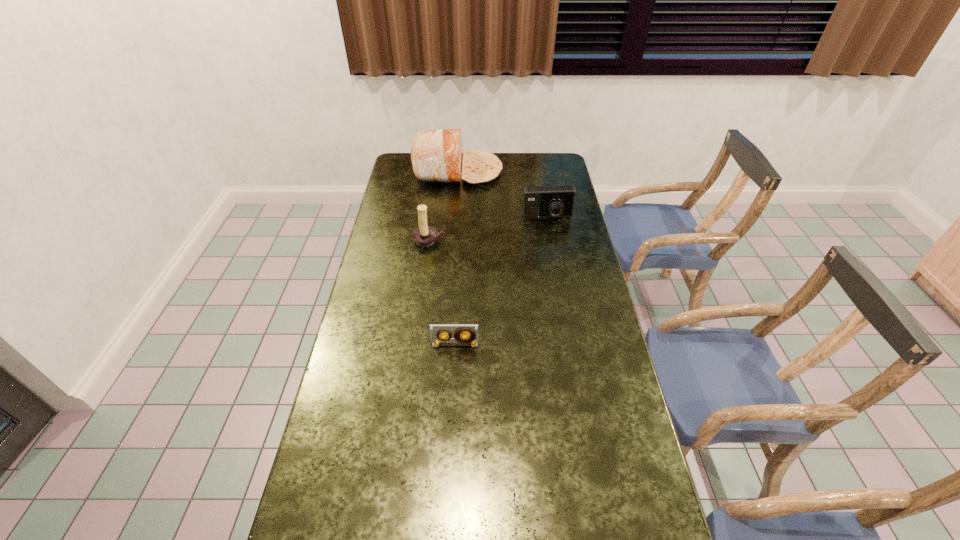
Where is `object that is at the far edge`? object that is at the far edge is located at coordinates (436, 155).

Where is `bread at the left edge`? The width and height of the screenshot is (960, 540). bread at the left edge is located at coordinates (436, 155).

Where is `candle holder at the left edge`? This screenshot has width=960, height=540. candle holder at the left edge is located at coordinates (424, 236).

The width and height of the screenshot is (960, 540). What are the coordinates of `object at the right edge` in the screenshot? It's located at (539, 202).

This screenshot has width=960, height=540. I want to click on object located in the far left corner section of the desktop, so click(x=436, y=155).

The height and width of the screenshot is (540, 960). Find the location of `vacant area at the left edge of the desktop`. vacant area at the left edge of the desktop is located at coordinates (333, 538).

This screenshot has width=960, height=540. In the image, there is a desktop. Find the location of `vacant space at the right edge`. vacant space at the right edge is located at coordinates (600, 489).

Find the location of a particular element. The width and height of the screenshot is (960, 540). blank region between the nearest object and the second farthest object is located at coordinates (501, 282).

Locate an element on the screen. This screenshot has height=540, width=960. free space between the second nearest object and the third tallest object is located at coordinates [x=489, y=230].

Identify the location of free spot between the videotape and the third farthest object. (443, 293).